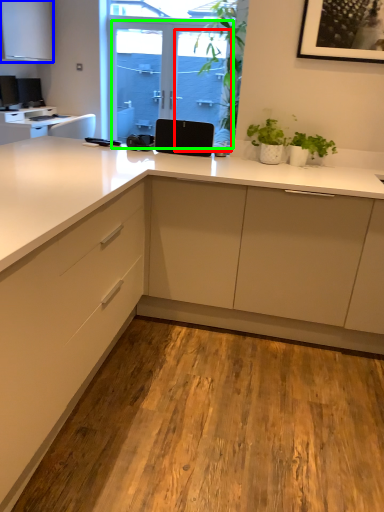
Question: Which is farther away from screen door (highlighted by a red box)? cabinetry (highlighted by a blue box) or screen door (highlighted by a green box)?

Choices:
 (A) cabinetry
 (B) screen door

Answer: (A)